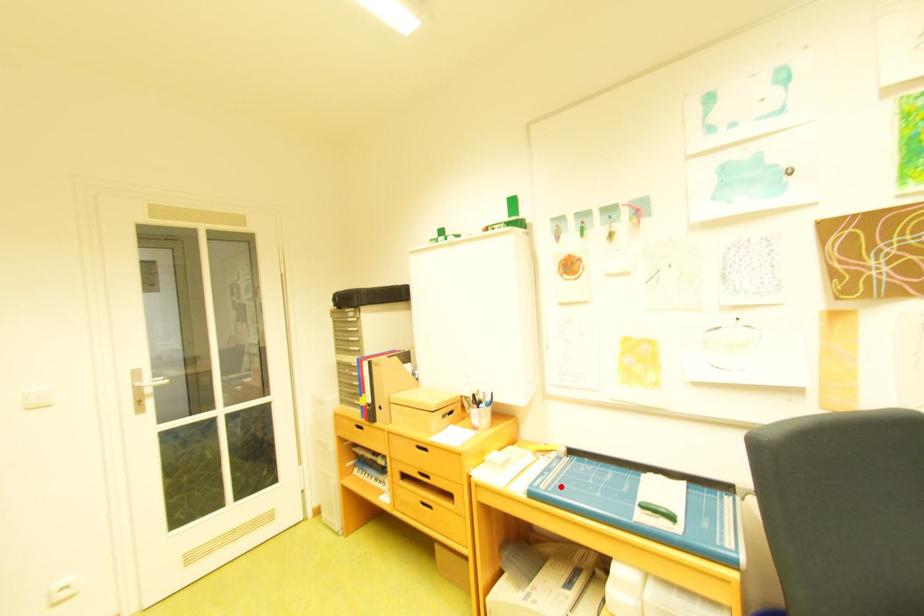
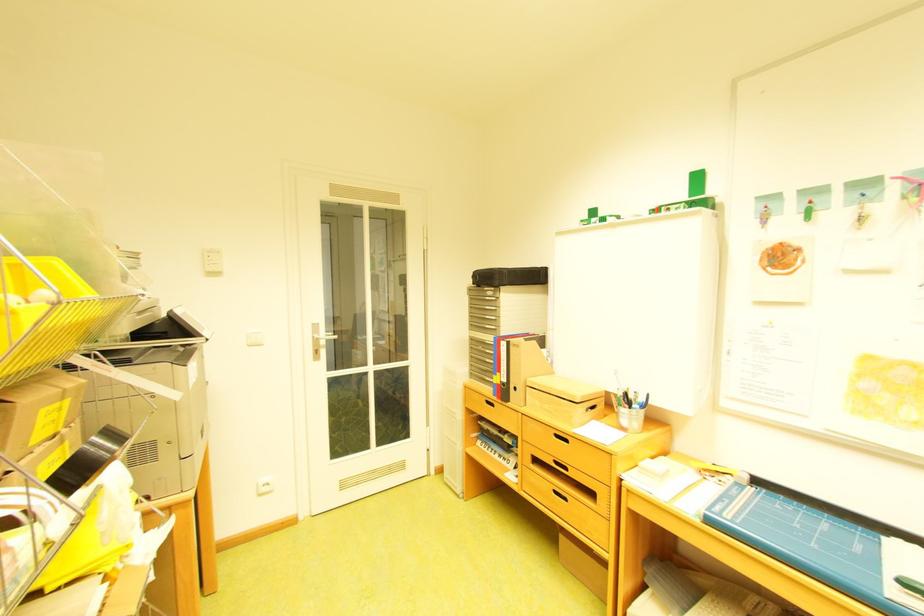
Find the pixel in the second image that matches the highlighted location in the first image.

(747, 517)